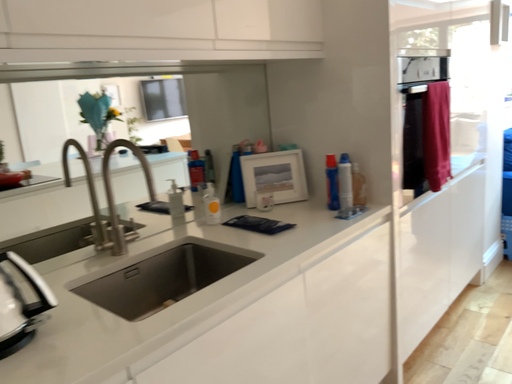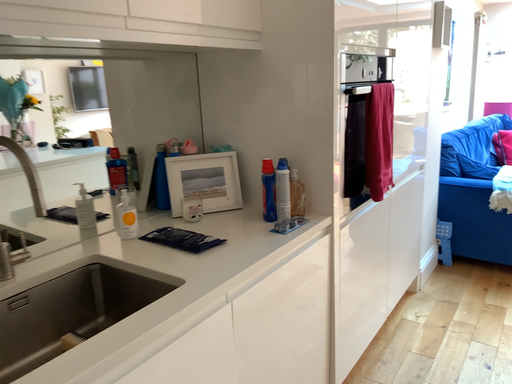
Question: How did the camera likely rotate when shooting the video?

Choices:
 (A) rotated right
 (B) rotated left

Answer: (A)